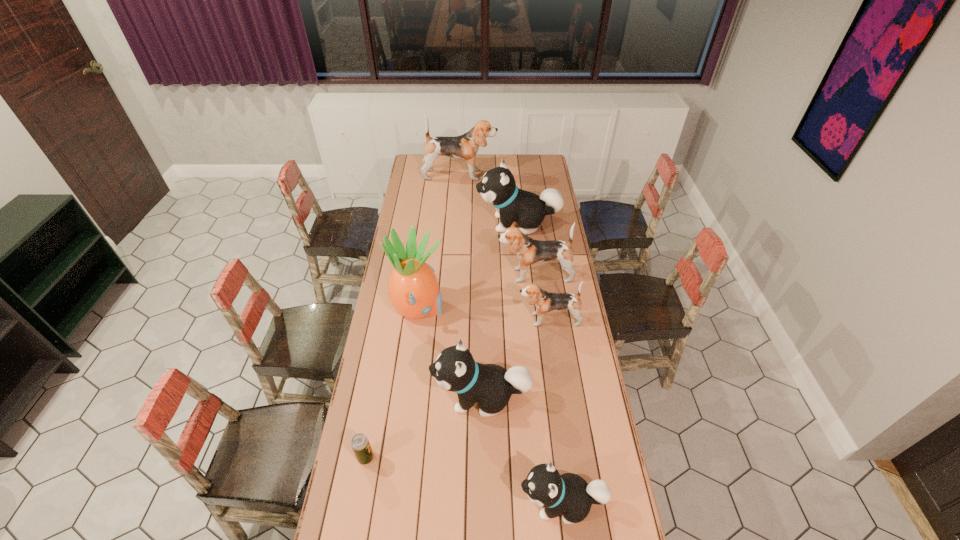
Image resolution: width=960 pixels, height=540 pixels. In order to click on the smallest brown puppy in this screenshot , I will do `click(544, 301)`.

What are the coordinates of `the nearest object` in the screenshot? It's located at pyautogui.click(x=569, y=493).

Find the location of a particular element. The height and width of the screenshot is (540, 960). the smallest white puppy is located at coordinates (569, 493).

At what (x,y) coordinates should I click in order to perform the action: click on beer can. Please return your answer as a coordinate pair (x, y). Looking at the image, I should click on (360, 444).

You are a GUI agent. You are given a task and a screenshot of the screen. Output one action in this format:
    pyautogui.click(x=<x>, y=<y>)
    Task: Click on the shortest object
    
    Given the screenshot: What is the action you would take?
    pyautogui.click(x=360, y=444)

At what (x,y) coordinates should I click in order to perform the action: click on free space located 0.190m at the face of the farthest object. Please return your answer as a coordinate pair (x, y). This screenshot has height=540, width=960. Looking at the image, I should click on (528, 175).

Identify the location of vacant space located at the entrance of the pineapple. The image size is (960, 540). (460, 310).

Identify the location of free space located 0.220m at the face of the second farthest object. This screenshot has width=960, height=540. (435, 224).

Image resolution: width=960 pixels, height=540 pixels. I want to click on free space located 0.350m at the face of the second farthest object, so click(410, 224).

I want to click on vacant area situated at the face of the second farthest object, so (x=461, y=224).